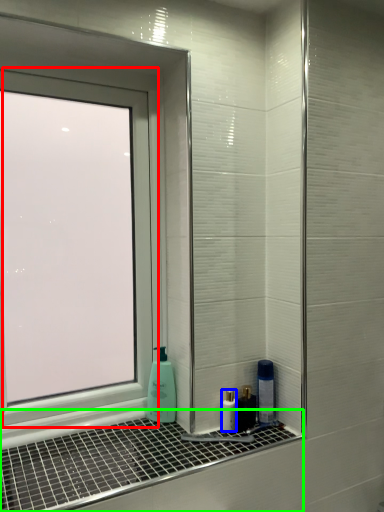
Question: Based on their relative distances, which object is farther from window (highlighted by a red box)? Choose from mouthwash (highlighted by a blue box) and window sill (highlighted by a green box).

Choices:
 (A) mouthwash
 (B) window sill

Answer: (A)